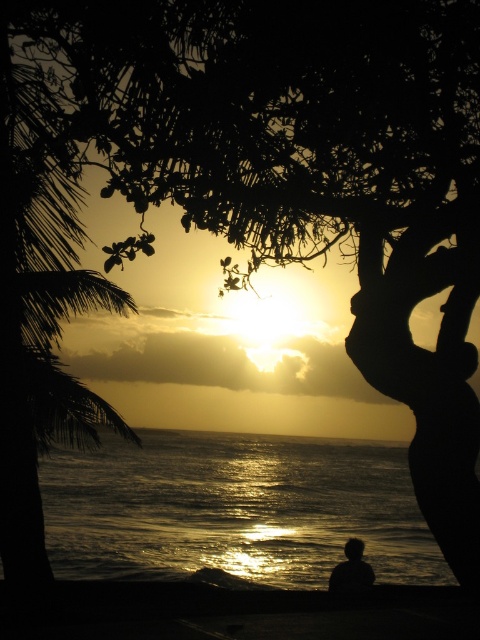
You are standing at the center of the image and want to find the silky black palm tree at left. Which direction should you look to locate it?

The silky black palm tree at left is located at point (38, 307), which is to the left side of the image. Therefore, you should look to your left to find it.

You are a photographer trying to capture the sunset scene. You want to frame the silhouette figure at center so that it is to the right of the silky black palm tree at left. Is this possible based on the current arrangement?

The silky black palm tree at left is positioned on the left side of the silhouette figure at center, so yes, the silhouette figure at center is already to the right of the silky black palm tree at left in the current arrangement.

You are standing at the point with coordinates point (38, 307) in the sunset scene. What object are you standing on?

You are standing on the silky black palm tree at left because the point (38, 307) is located on it according to the description.